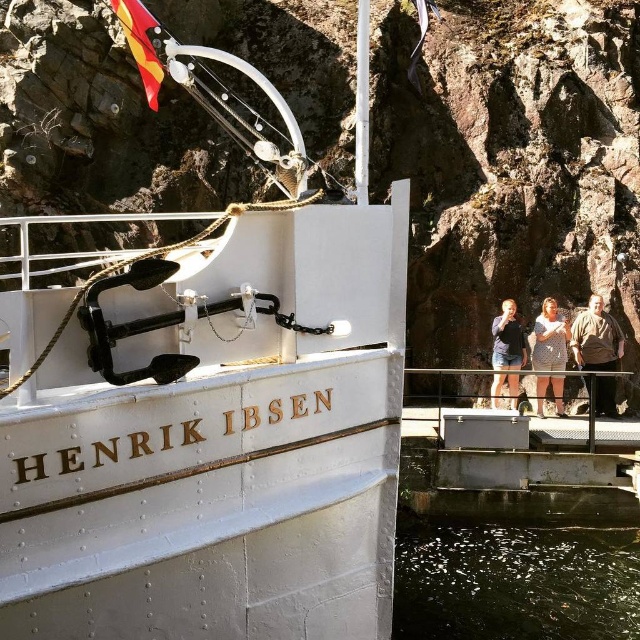
Who is higher up, brown leather jacket at right or denim shorts at center?

Positioned higher is denim shorts at center.

Between point (614, 344) and point (499, 340), which one is positioned in front?

Point (499, 340) is more forward.

In order to click on brown leather jacket at right in this screenshot , I will do `click(596, 339)`.

Locate an element on the screen. The width and height of the screenshot is (640, 640). brown leather jacket at right is located at coordinates (596, 339).

Does white polished wood boat at center come behind brown leather jacket at right?

No.

Is point (232, 125) farther from camera compared to point (572, 346)?

Yes, point (232, 125) is farther from viewer.

Where is `white polished wood boat at center`? white polished wood boat at center is located at coordinates coord(209,426).

Is dark reflective water at lower center above denim shorts at center?

Actually, dark reflective water at lower center is below denim shorts at center.

Does point (467, 625) come closer to viewer compared to point (500, 353)?

Yes, it is.

Which is behind, point (401, 595) or point (512, 323)?

Positioned behind is point (512, 323).

Identify the location of dark reflective water at lower center. (515, 580).